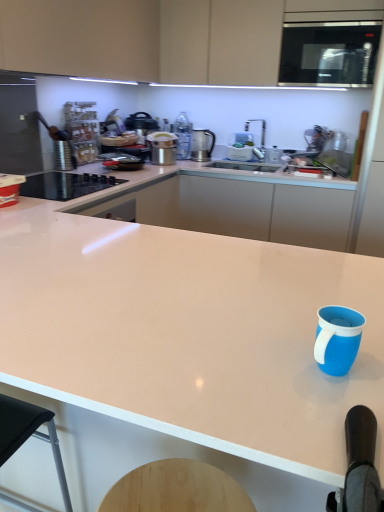
The width and height of the screenshot is (384, 512). In order to click on black glass cooktop at left in this screenshot , I will do `click(65, 185)`.

In order to face white glossy countertop at center, which is the 2th countertop in front-to-back order, should I rotate leftwards or rightwards?

To align with it, rotate right about 4.505°.

This screenshot has height=512, width=384. In order to click on white glossy countertop at center, the first countertop positioned from the back in this screenshot , I will do `click(236, 206)`.

What do you see at coordinates (202, 145) in the screenshot? I see `satin silver kettle at upper center, marked as the second kitchen appliance in a front-to-back arrangement` at bounding box center [202, 145].

Locate an element on the screen. satin silver kettle at upper center, arranged as the first kitchen appliance when viewed from the back is located at coordinates (202, 145).

Identify the location of blue matte mug at lower right. This screenshot has width=384, height=512. tap(337, 339).

What is the approximate height of blue matte mug at lower right?

blue matte mug at lower right is 4.35 inches in height.

The height and width of the screenshot is (512, 384). I want to click on metallic silver pot at upper center, which ranks as the 2th kitchen appliance in back-to-front order, so coord(162,148).

Is satin black microwave at upper right turned away from black glass cooktop at left?

satin black microwave at upper right does not have its back to black glass cooktop at left.

Does satin black microwave at upper right have a lesser width compared to black glass cooktop at left?

Yes.

Would you say black glass cooktop at left is part of satin black microwave at upper right's contents?

No, black glass cooktop at left is not a part of satin black microwave at upper right.

Is white glossy countertop at center, which is the first countertop in front-to-back order, inside blue matte mug at lower right?

Definitely not — white glossy countertop at center, which is the first countertop in front-to-back order, is not inside blue matte mug at lower right.

From the image's perspective, which object appears higher, blue matte mug at lower right or white glossy countertop at center, which is the first countertop in front-to-back order?

blue matte mug at lower right is shown above in the image.

Is blue matte mug at lower right aimed at white glossy countertop at center, which is the first countertop in front-to-back order?

No.

Is white glossy countertop at center, which is the 2th countertop in front-to-back order, to the left of satin silver kettle at upper center, arranged as the first kitchen appliance when viewed from the back, from the viewer's perspective?

In fact, white glossy countertop at center, which is the 2th countertop in front-to-back order, is to the right of satin silver kettle at upper center, arranged as the first kitchen appliance when viewed from the back.

Considering the points (259, 214) and (210, 154), which point is behind, point (259, 214) or point (210, 154)?

The point (210, 154) is farther.

Between white glossy countertop at center, which is the 2th countertop in front-to-back order, and satin silver kettle at upper center, marked as the 2th kitchen appliance in a left-to-right arrangement, which one has more height?

Standing taller between the two is white glossy countertop at center, which is the 2th countertop in front-to-back order.

From a real-world perspective, is satin black microwave at upper right on top of satin silver kettle at upper center, marked as the 1th kitchen appliance in a right-to-left arrangement?

Yes.

Could satin silver kettle at upper center, marked as the 1th kitchen appliance in a right-to-left arrangement, be considered to be inside satin black microwave at upper right?

No, satin black microwave at upper right does not contain satin silver kettle at upper center, marked as the 1th kitchen appliance in a right-to-left arrangement.

Considering the sizes of objects satin black microwave at upper right and satin silver kettle at upper center, marked as the second kitchen appliance in a front-to-back arrangement, in the image provided, who is taller, satin black microwave at upper right or satin silver kettle at upper center, marked as the second kitchen appliance in a front-to-back arrangement,?

satin black microwave at upper right.

Can you tell me how much satin black microwave at upper right and satin silver kettle at upper center, arranged as the first kitchen appliance when viewed from the back, differ in facing direction?

satin black microwave at upper right and satin silver kettle at upper center, arranged as the first kitchen appliance when viewed from the back, are facing 2.49 degrees away from each other.

Consider the image. Is satin black microwave at upper right beside metallic silver pot at upper center, positioned as the 2th kitchen appliance in right-to-left order?

No, satin black microwave at upper right is not making contact with metallic silver pot at upper center, positioned as the 2th kitchen appliance in right-to-left order.

Considering the sizes of objects satin black microwave at upper right and metallic silver pot at upper center, which ranks as the 2th kitchen appliance in back-to-front order, in the image provided, who is wider, satin black microwave at upper right or metallic silver pot at upper center, which ranks as the 2th kitchen appliance in back-to-front order,?

satin black microwave at upper right is wider.

Would you say satin black microwave at upper right is inside or outside metallic silver pot at upper center, the first kitchen appliance in the left-to-right sequence?

The correct answer is: outside.

You are a GUI agent. You are given a task and a screenshot of the screen. Output one action in this format:
    pyautogui.click(x=<x>, y=<y>)
    Task: Click on the microwave oven in front of the metallic silver pot at upper center, which ranks as the 2th kitchen appliance in back-to-front order
    Image resolution: width=384 pixels, height=512 pixels.
    Given the screenshot: What is the action you would take?
    pyautogui.click(x=329, y=52)

Locate an element on the screen. the 1st countertop in front of the metallic silver pot at upper center, which ranks as the 2th kitchen appliance in back-to-front order, starting your count from the anchor is located at coordinates (236, 206).

Is white glossy countertop at center, which is the 2th countertop in front-to-back order, shorter than metallic silver pot at upper center, positioned as the 2th kitchen appliance in right-to-left order?

No, white glossy countertop at center, which is the 2th countertop in front-to-back order, is not shorter than metallic silver pot at upper center, positioned as the 2th kitchen appliance in right-to-left order.

How different are the orientations of white glossy countertop at center, which is the 2th countertop in front-to-back order, and metallic silver pot at upper center, which ranks as the 2th kitchen appliance in back-to-front order, in degrees?

88.9 degrees.

Does white glossy countertop at center, which is the 2th countertop in front-to-back order, come in front of metallic silver pot at upper center, positioned as the 2th kitchen appliance in right-to-left order?

Yes, it is in front of metallic silver pot at upper center, positioned as the 2th kitchen appliance in right-to-left order.

From the picture: Can you tell me how much white glossy countertop at center, acting as the 2th countertop starting from the back, and black glass cooktop at left differ in facing direction?

The facing directions of white glossy countertop at center, acting as the 2th countertop starting from the back, and black glass cooktop at left are 89.7 degrees apart.

In the image, is white glossy countertop at center, acting as the 2th countertop starting from the back, positioned in front of or behind black glass cooktop at left?

Clearly, white glossy countertop at center, acting as the 2th countertop starting from the back, is in front of black glass cooktop at left.

Are white glossy countertop at center, acting as the 2th countertop starting from the back, and black glass cooktop at left far apart?

No, white glossy countertop at center, acting as the 2th countertop starting from the back, is not far from black glass cooktop at left.

Is white glossy countertop at center, acting as the 2th countertop starting from the back, shorter than black glass cooktop at left?

Incorrect, the height of white glossy countertop at center, acting as the 2th countertop starting from the back, does not fall short of that of black glass cooktop at left.

This screenshot has height=512, width=384. I want to click on home appliance below the satin black microwave at upper right (from a real-world perspective), so click(65, 185).

Where is `mug located above the white glossy countertop at center, which is the first countertop in front-to-back order (from a real-world perspective)`? The height and width of the screenshot is (512, 384). mug located above the white glossy countertop at center, which is the first countertop in front-to-back order (from a real-world perspective) is located at coordinates (337, 339).

Considering their positions, is white glossy countertop at center, which is the first countertop in front-to-back order, positioned closer to metallic silver pot at upper center, which ranks as the 2th kitchen appliance in back-to-front order, than satin black microwave at upper right?

satin black microwave at upper right lies closer to metallic silver pot at upper center, which ranks as the 2th kitchen appliance in back-to-front order, than the other object.

When comparing their distances from metallic silver pot at upper center, positioned as the 2th kitchen appliance in right-to-left order, does white glossy countertop at center, the first countertop positioned from the back, or blue matte mug at lower right seem further?

blue matte mug at lower right is positioned further to the anchor metallic silver pot at upper center, positioned as the 2th kitchen appliance in right-to-left order.

In the scene shown: Considering their positions, is satin silver kettle at upper center, marked as the 1th kitchen appliance in a right-to-left arrangement, positioned further to satin black microwave at upper right than blue matte mug at lower right?

blue matte mug at lower right.

Looking at the image, which one is located further to white glossy countertop at center, which is the first countertop in front-to-back order, satin black microwave at upper right or metallic silver pot at upper center, the 1th kitchen appliance positioned from the front?

Among the two, satin black microwave at upper right is located further to white glossy countertop at center, which is the first countertop in front-to-back order.

Estimate the real-world distances between objects in this image. Which object is further from satin black microwave at upper right, white glossy countertop at center, the first countertop positioned from the back, or white glossy countertop at center, which is the first countertop in front-to-back order?

white glossy countertop at center, which is the first countertop in front-to-back order, is further to satin black microwave at upper right.

When comparing their distances from blue matte mug at lower right, does black glass cooktop at left or satin silver kettle at upper center, arranged as the first kitchen appliance when viewed from the back, seem closer?

The object closer to blue matte mug at lower right is black glass cooktop at left.

Which object lies further to the anchor point satin black microwave at upper right, white glossy countertop at center, which is the 2th countertop in front-to-back order, or satin silver kettle at upper center, marked as the 2th kitchen appliance in a left-to-right arrangement?

satin silver kettle at upper center, marked as the 2th kitchen appliance in a left-to-right arrangement, is further to satin black microwave at upper right.

Based on their spatial positions, is metallic silver pot at upper center, the 1th kitchen appliance positioned from the front, or black glass cooktop at left further from satin silver kettle at upper center, marked as the second kitchen appliance in a front-to-back arrangement?

black glass cooktop at left lies further to satin silver kettle at upper center, marked as the second kitchen appliance in a front-to-back arrangement, than the other object.

The width and height of the screenshot is (384, 512). I want to click on home appliance located between white glossy countertop at center, acting as the 2th countertop starting from the back, and metallic silver pot at upper center, positioned as the 2th kitchen appliance in right-to-left order, in the depth direction, so click(x=65, y=185).

The image size is (384, 512). I want to click on countertop between blue matte mug at lower right and metallic silver pot at upper center, the 1th kitchen appliance positioned from the front, along the z-axis, so click(236, 206).

Identify the location of microwave oven between white glossy countertop at center, acting as the 2th countertop starting from the back, and white glossy countertop at center, which is the 2th countertop in front-to-back order, along the z-axis. (329, 52).

This screenshot has height=512, width=384. Identify the location of home appliance between blue matte mug at lower right and white glossy countertop at center, which is the 2th countertop in front-to-back order, from front to back. (65, 185).